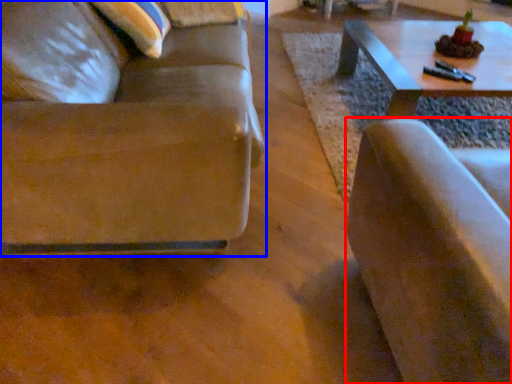
Question: Which object appears closest to the camera in this image, chair (highlighted by a red box) or studio couch (highlighted by a blue box)?

Choices:
 (A) chair
 (B) studio couch

Answer: (A)